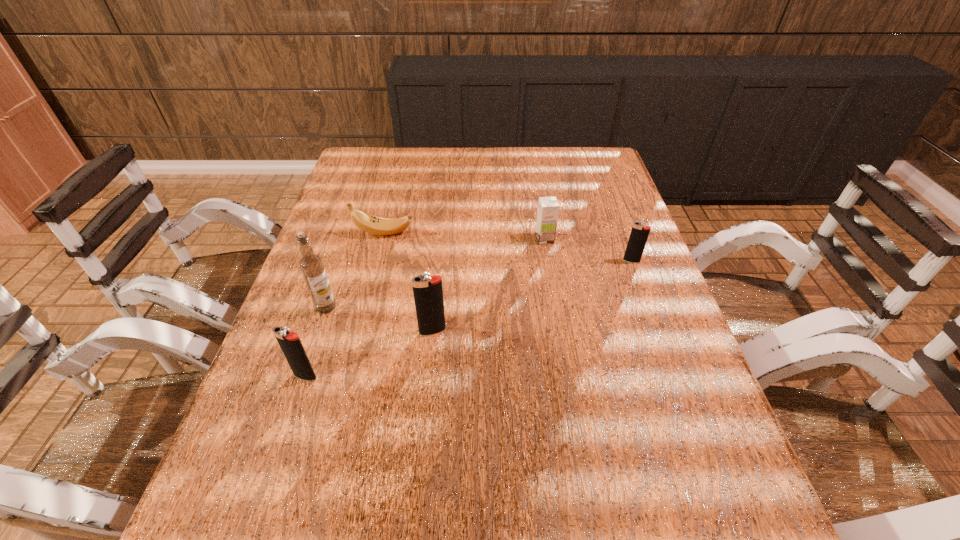
Where is `free point at the far edge`? This screenshot has width=960, height=540. free point at the far edge is located at coordinates (462, 152).

In the image, there is a desktop. At what (x,y) coordinates should I click in order to perform the action: click on free region at the near edge. Please return your answer as a coordinate pair (x, y). The width and height of the screenshot is (960, 540). Looking at the image, I should click on (592, 443).

Locate an element on the screen. The image size is (960, 540). free space at the left edge of the desktop is located at coordinates (278, 359).

This screenshot has width=960, height=540. Identify the location of free space at the far left corner of the desktop. (367, 160).

Image resolution: width=960 pixels, height=540 pixels. In the image, there is a desktop. Find the location of `vacant space at the near right corner`. vacant space at the near right corner is located at coordinates (660, 449).

You are a GUI agent. You are given a task and a screenshot of the screen. Output one action in this format:
    pyautogui.click(x=<x>, y=<y>)
    Task: Click on the vacant area that lies between the second shortest igniter and the farthest igniter
    
    Given the screenshot: What is the action you would take?
    pyautogui.click(x=468, y=319)

The width and height of the screenshot is (960, 540). In order to click on free space that is in between the chocolate milk and the second igniter from left to right in this screenshot , I will do `click(489, 285)`.

You are a GUI agent. You are given a task and a screenshot of the screen. Output one action in this format:
    pyautogui.click(x=<x>, y=<y>)
    Task: Click on the vacant region between the leftmost igniter and the second igniter from right to left
    Image resolution: width=960 pixels, height=540 pixels.
    Given the screenshot: What is the action you would take?
    pyautogui.click(x=369, y=354)

Locate an element on the screen. This screenshot has height=540, width=960. free space between the third nearest object and the rightmost igniter is located at coordinates (479, 284).

The width and height of the screenshot is (960, 540). What are the coordinates of `vacant region between the shortest object and the third object from right to left` in the screenshot? It's located at (408, 282).